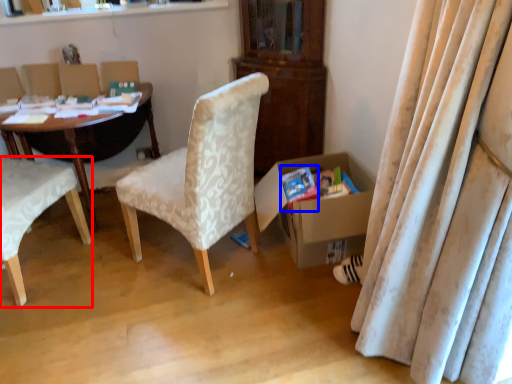
Question: Which object appears farthest to the camera in this image, chair (highlighted by a red box) or paperback book (highlighted by a blue box)?

Choices:
 (A) chair
 (B) paperback book

Answer: (B)